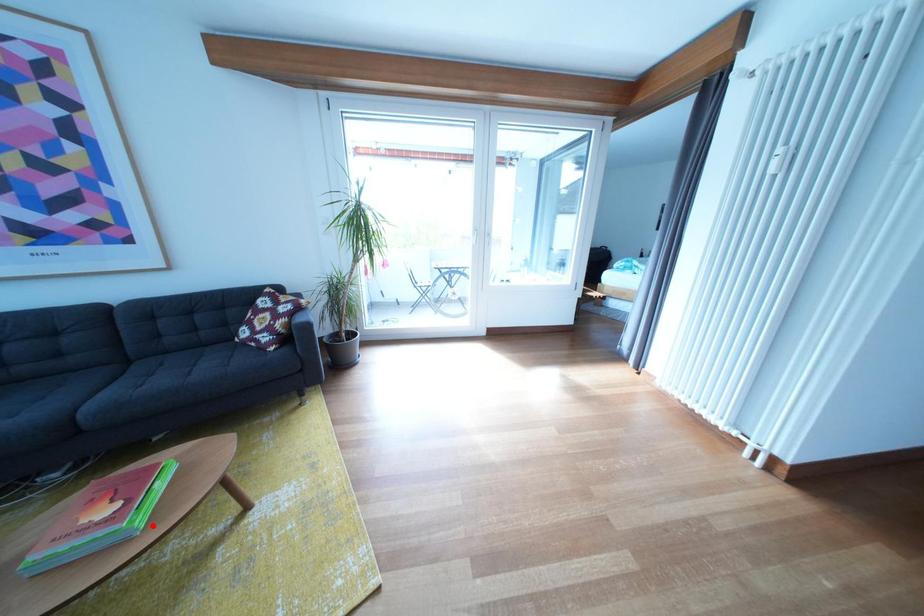
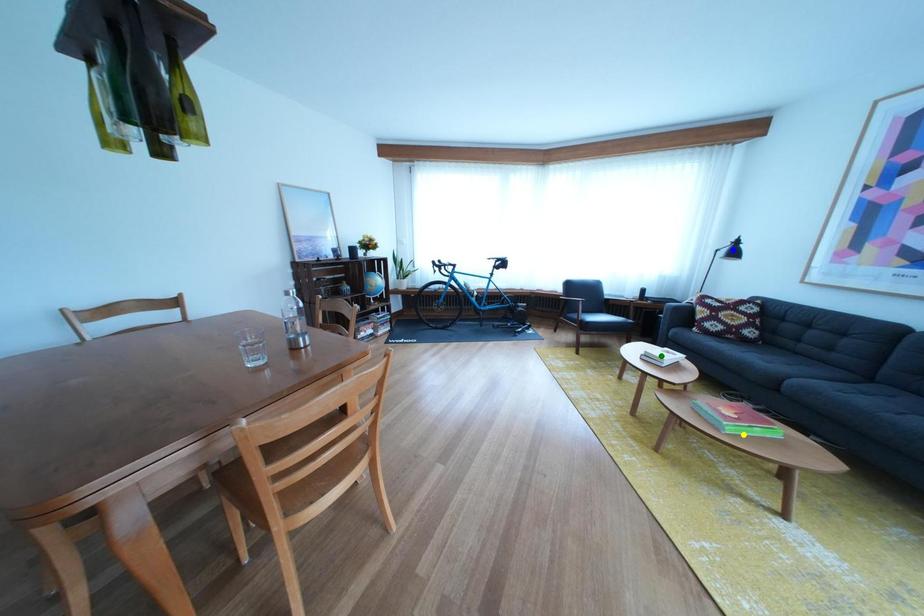
Question: I am providing you with two images of the same scene from different viewpoints. A red point is marked on the first image. You are given multiple points on the second image. Which spot in image 2 lines up with the point in image 1?

Choices:
 (A) blue point
 (B) yellow point
 (C) green point

Answer: (B)